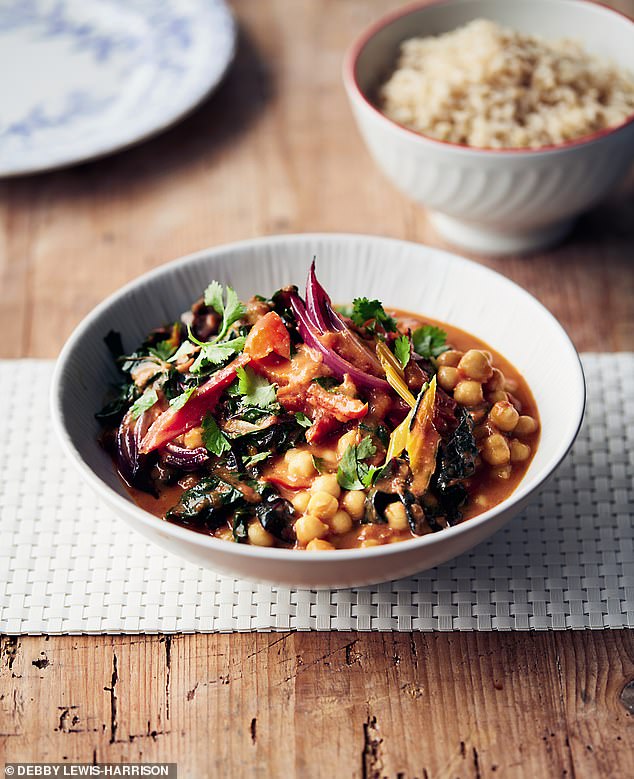
This screenshot has height=779, width=634. I want to click on plate, so (40, 76), (93, 25), (127, 124).